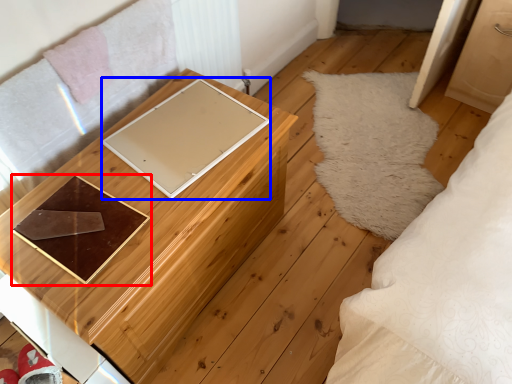
Question: Among these objects, which one is nearest to the camera, tray (highlighted by a red box) or pad (highlighted by a blue box)?

Choices:
 (A) tray
 (B) pad

Answer: (A)